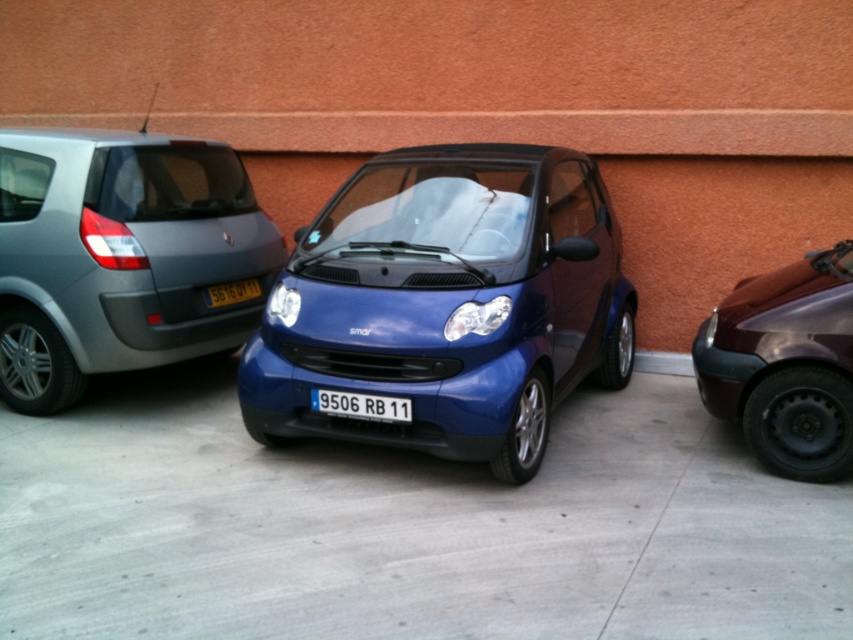
Question: Observing the image, what is the correct spatial positioning of metallic blue car at center in reference to metallic gray minivan at left?

Choices:
 (A) left
 (B) right

Answer: (B)

Question: Considering the relative positions of metallic blue car at center and glossy maroon car at right in the image provided, where is metallic blue car at center located with respect to glossy maroon car at right?

Choices:
 (A) right
 (B) left

Answer: (B)

Question: Which point is closer to the camera?

Choices:
 (A) (753, 340)
 (B) (209, 294)
 (C) (460, 308)
 (D) (113, 368)

Answer: (C)

Question: Is metallic gray minivan at left thinner than black plastic license plate at center?

Choices:
 (A) no
 (B) yes

Answer: (A)

Question: Which is nearer to the black plastic license plate at center?

Choices:
 (A) glossy maroon car at right
 (B) blue metallic license plate at center
 (C) metallic blue car at center

Answer: (B)

Question: Which object is positioned farthest from the blue metallic license plate at center?

Choices:
 (A) glossy maroon car at right
 (B) black plastic license plate at center
 (C) metallic blue car at center
 (D) metallic gray minivan at left

Answer: (A)